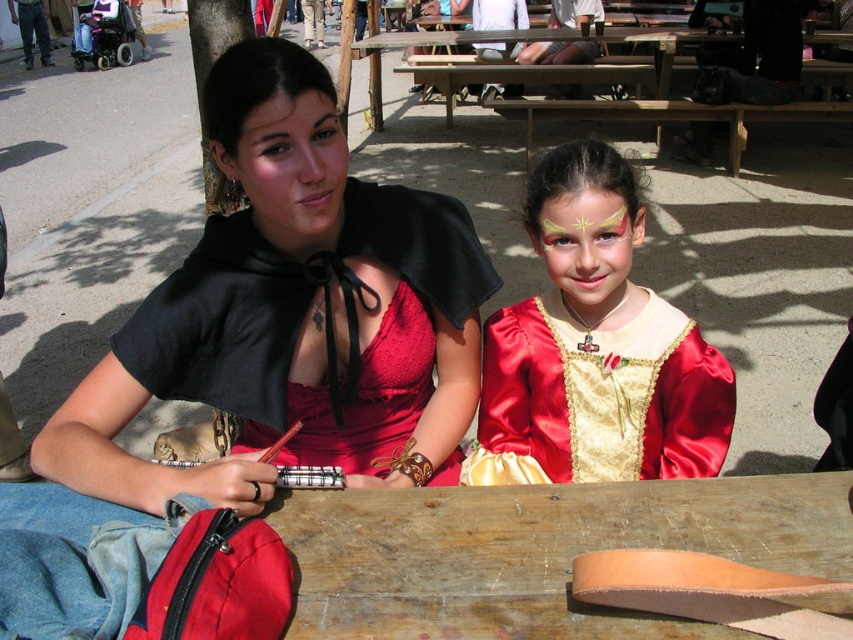
Question: Which object appears farthest from the camera in this image?

Choices:
 (A) matte black cape at upper center
 (B) satin gold dress at center
 (C) matte black cape at upper left
 (D) wooden at center

Answer: (B)

Question: Does satin gold dress at center have a smaller size compared to matte black cape at upper center?

Choices:
 (A) yes
 (B) no

Answer: (B)

Question: Which of the following is the closest to the observer?

Choices:
 (A) (546, 236)
 (B) (352, 634)
 (C) (328, 202)

Answer: (B)

Question: Is matte black cape at upper left to the left of matte black cape at upper center from the viewer's perspective?

Choices:
 (A) no
 (B) yes

Answer: (A)

Question: Which point appears closest to the camera in this image?

Choices:
 (A) tap(244, 172)
 (B) tap(392, 476)

Answer: (A)

Question: Is matte black cape at upper center behind shiny gold face paint at center?

Choices:
 (A) no
 (B) yes

Answer: (A)